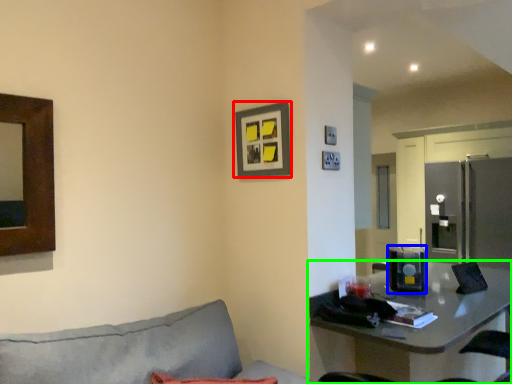
Question: Which is nearer to the picture frame (highlighted by a red box)? appliance (highlighted by a blue box) or table (highlighted by a green box).

Choices:
 (A) appliance
 (B) table

Answer: (B)